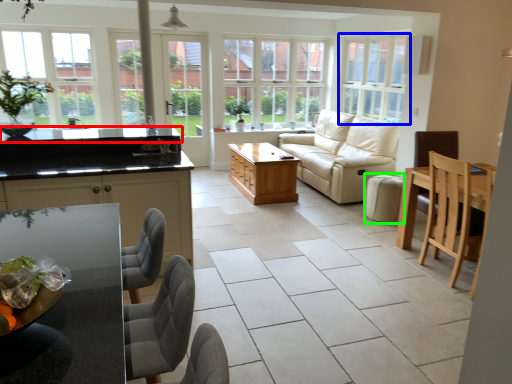
Question: Considering the real-world distances, which object is closest to countertop (highlighted by a red box)? window (highlighted by a blue box) or bar stool (highlighted by a green box).

Choices:
 (A) window
 (B) bar stool

Answer: (A)